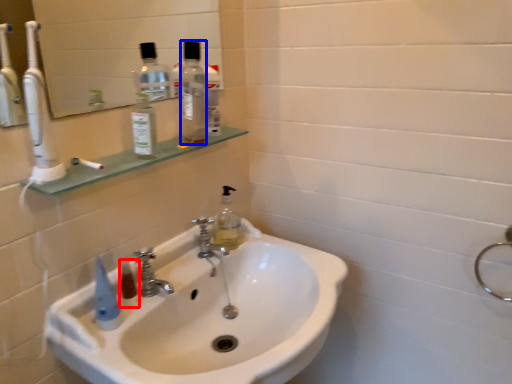
Question: Among these objects, which one is farthest to the camera, mouthwash (highlighted by a red box) or bottle (highlighted by a blue box)?

Choices:
 (A) mouthwash
 (B) bottle

Answer: (B)